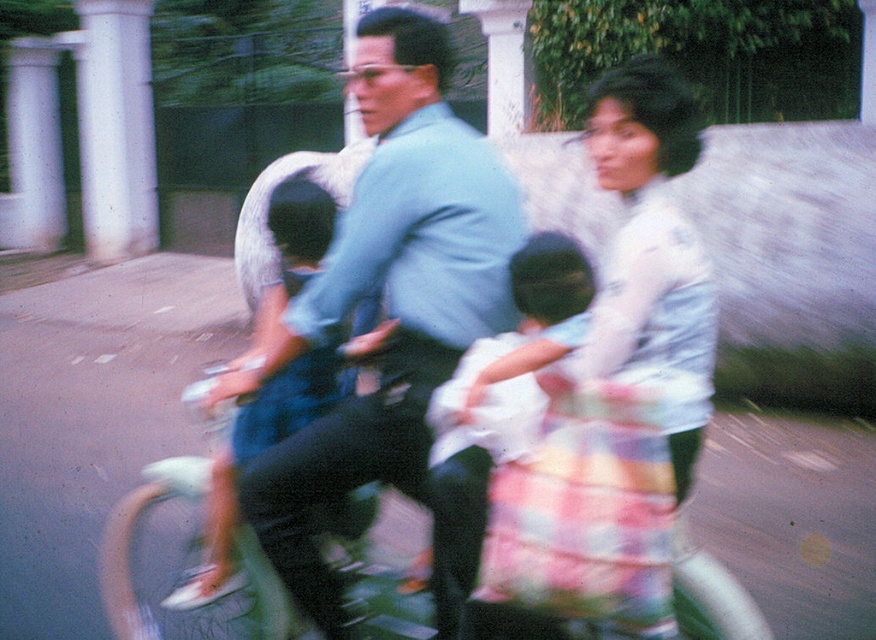
Is light blue shirt at center thinner than light blue denim shorts at center?

Incorrect, light blue shirt at center's width is not less than light blue denim shorts at center's.

Which is below, light blue shirt at center or light blue denim shorts at center?

light blue denim shorts at center

Between point (442, 230) and point (368, 324), which one is positioned in front?

Point (442, 230)

Find the location of a particular element. Image resolution: width=876 pixels, height=640 pixels. light blue shirt at center is located at coordinates (387, 298).

Which is more to the left, metallic green bicycle at center or light blue denim shorts at center?

Positioned to the left is metallic green bicycle at center.

Does metallic green bicycle at center have a lesser height compared to light blue denim shorts at center?

Correct, metallic green bicycle at center is not as tall as light blue denim shorts at center.

Who is more distant from viewer, [239,612] or [225,449]?

The point [239,612] is behind.

The image size is (876, 640). What are the coordinates of `metallic green bicycle at center` in the screenshot? It's located at (201, 608).

Does white satin blouse at center have a greater height compared to metallic green bicycle at center?

Yes, white satin blouse at center is taller than metallic green bicycle at center.

Which is more to the right, white satin blouse at center or metallic green bicycle at center?

From the viewer's perspective, white satin blouse at center appears more on the right side.

What do you see at coordinates (617, 378) in the screenshot?
I see `white satin blouse at center` at bounding box center [617, 378].

Locate an element on the screen. white satin blouse at center is located at coordinates (617, 378).